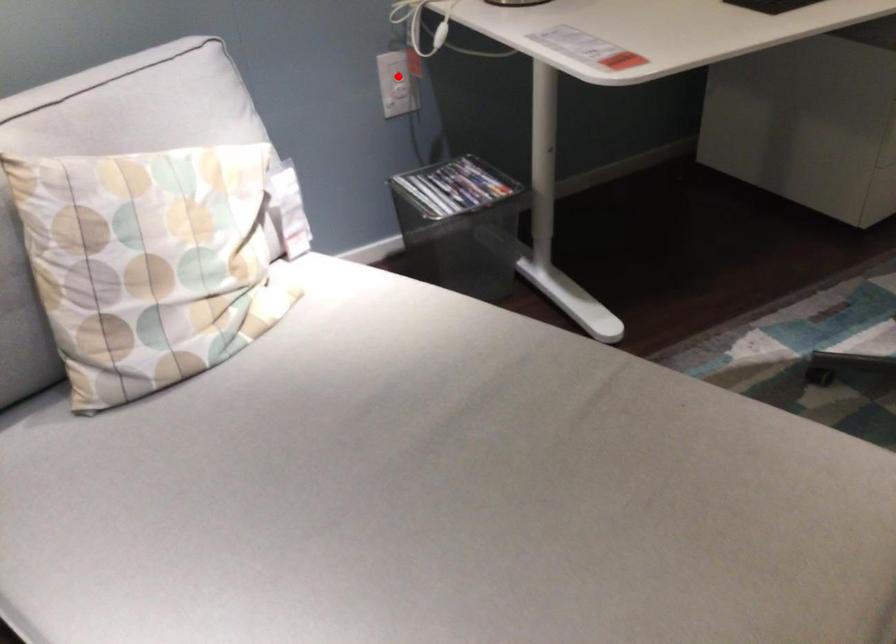
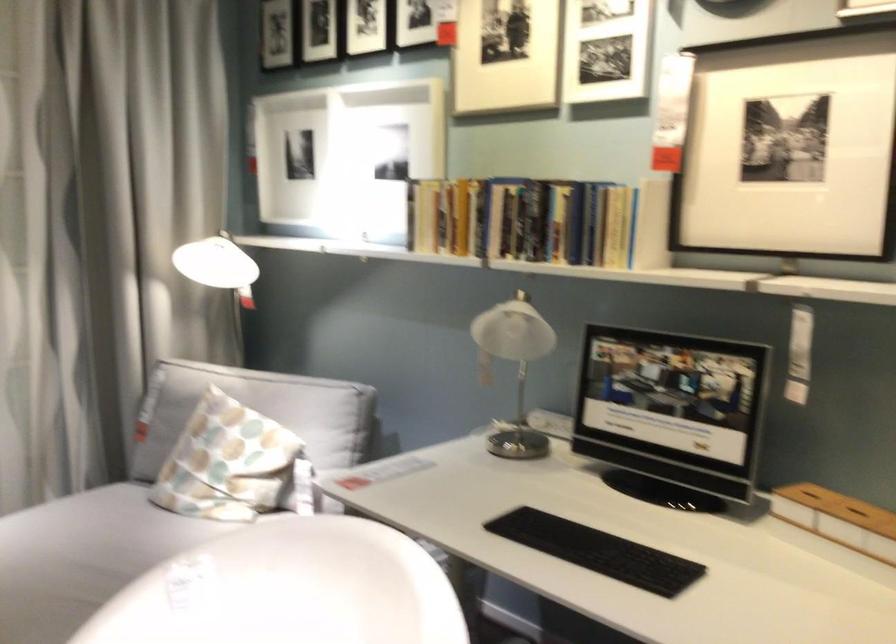
Question: I am providing you with two images of the same scene from different viewpoints. A red point is marked on the first image. At the location where the point appears in image 1, is it still visible in image 2?

Choices:
 (A) Yes
 (B) No

Answer: (B)